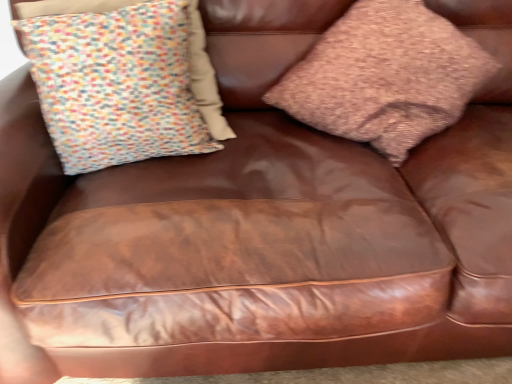
Question: Should I look upward or downward to see brown textured pillow at upper right, which is counted as the first pillow, starting from the right?

Choices:
 (A) up
 (B) down

Answer: (A)

Question: Considering the relative sizes of multicolored fabric pillow at upper left, acting as the 1th pillow starting from the left, and brown textured pillow at upper right, which is counted as the first pillow, starting from the right, in the image provided, is multicolored fabric pillow at upper left, acting as the 1th pillow starting from the left, smaller than brown textured pillow at upper right, which is counted as the first pillow, starting from the right,?

Choices:
 (A) no
 (B) yes

Answer: (B)

Question: Is multicolored fabric pillow at upper left, which appears as the second pillow when viewed from the right, positioned in front of brown textured pillow at upper right, which is counted as the first pillow, starting from the right?

Choices:
 (A) yes
 (B) no

Answer: (B)

Question: Does multicolored fabric pillow at upper left, acting as the 1th pillow starting from the left, contain brown textured pillow at upper right, which is counted as the first pillow, starting from the right?

Choices:
 (A) yes
 (B) no

Answer: (B)

Question: Could you tell me if multicolored fabric pillow at upper left, which appears as the second pillow when viewed from the right, is facing brown textured pillow at upper right, the 2th pillow viewed from the left?

Choices:
 (A) yes
 (B) no

Answer: (B)

Question: Considering the relative sizes of multicolored fabric pillow at upper left, acting as the 1th pillow starting from the left, and brown textured pillow at upper right, which is counted as the first pillow, starting from the right, in the image provided, is multicolored fabric pillow at upper left, acting as the 1th pillow starting from the left, taller than brown textured pillow at upper right, which is counted as the first pillow, starting from the right,?

Choices:
 (A) yes
 (B) no

Answer: (B)

Question: From the image's perspective, does multicolored fabric pillow at upper left, acting as the 1th pillow starting from the left, appear lower than brown textured pillow at upper right, which is counted as the first pillow, starting from the right?

Choices:
 (A) yes
 (B) no

Answer: (A)

Question: Does brown textured pillow at upper right, which is counted as the first pillow, starting from the right, have a greater width compared to multicolored fabric pillow at upper left, which appears as the second pillow when viewed from the right?

Choices:
 (A) yes
 (B) no

Answer: (A)

Question: Considering the relative sizes of brown textured pillow at upper right, which is counted as the first pillow, starting from the right, and multicolored fabric pillow at upper left, which appears as the second pillow when viewed from the right, in the image provided, is brown textured pillow at upper right, which is counted as the first pillow, starting from the right, smaller than multicolored fabric pillow at upper left, which appears as the second pillow when viewed from the right,?

Choices:
 (A) yes
 (B) no

Answer: (B)

Question: Is brown textured pillow at upper right, which is counted as the first pillow, starting from the right, to the right of multicolored fabric pillow at upper left, acting as the 1th pillow starting from the left, from the viewer's perspective?

Choices:
 (A) no
 (B) yes

Answer: (B)

Question: Does brown textured pillow at upper right, the 2th pillow viewed from the left, come behind multicolored fabric pillow at upper left, acting as the 1th pillow starting from the left?

Choices:
 (A) no
 (B) yes

Answer: (A)

Question: Is brown textured pillow at upper right, which is counted as the first pillow, starting from the right, turned away from multicolored fabric pillow at upper left, acting as the 1th pillow starting from the left?

Choices:
 (A) no
 (B) yes

Answer: (A)

Question: From the image's perspective, is brown textured pillow at upper right, which is counted as the first pillow, starting from the right, on top of multicolored fabric pillow at upper left, which appears as the second pillow when viewed from the right?

Choices:
 (A) no
 (B) yes

Answer: (B)

Question: Visually, is brown textured pillow at upper right, which is counted as the first pillow, starting from the right, positioned to the left or to the right of multicolored fabric pillow at upper left, acting as the 1th pillow starting from the left?

Choices:
 (A) left
 (B) right

Answer: (B)